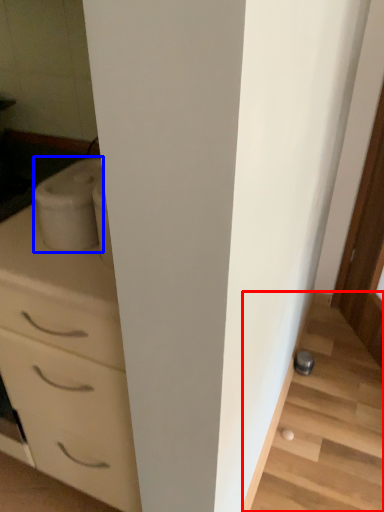
Question: Which object is further to the camera taking this photo, stairwell (highlighted by a red box) or appliance (highlighted by a blue box)?

Choices:
 (A) stairwell
 (B) appliance

Answer: (A)